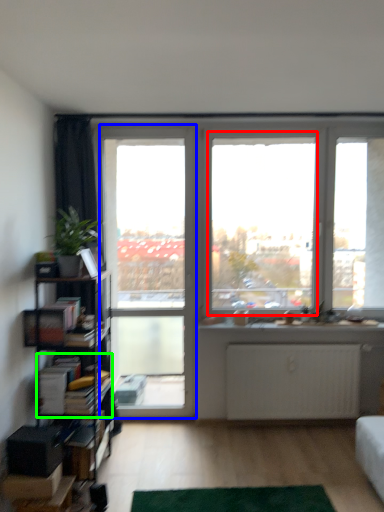
Question: Considering the real-world distances, which object is farthest from window screen (highlighted by a red box)? screen door (highlighted by a blue box) or book (highlighted by a green box)?

Choices:
 (A) screen door
 (B) book

Answer: (B)